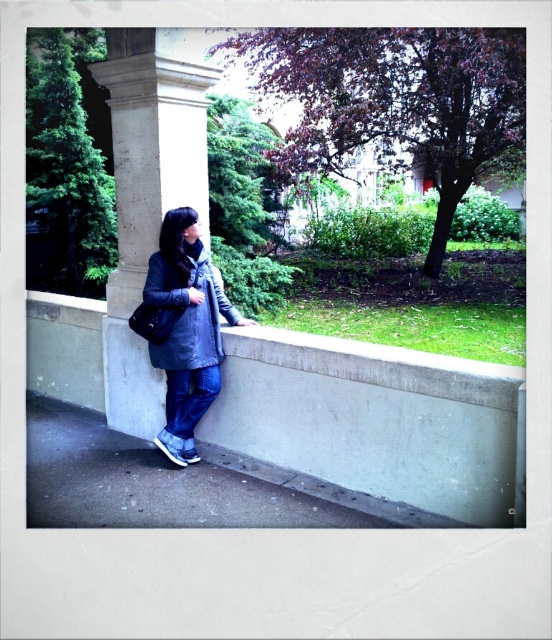
You are planning to hang a wide poster on the matte gray concrete wall at center and the smooth concrete pillar at center. Based on their widths, which surface would be more suitable for the poster?

The smooth concrete pillar at center has a greater width than the matte gray concrete wall at center, so it would be more suitable for hanging a wide poster.

You are a painter who needs to paint the smooth concrete pillar at center and the dark gray textured coat at center. Which object requires a taller ladder to reach its top?

The smooth concrete pillar at center requires a taller ladder because it is much taller than the dark gray textured coat at center.

You are standing at the point marked by the coordinates point (x=148, y=189). What object are you in front of?

The point (x=148, y=189) indicates a smooth concrete pillar at center, so you are in front of the smooth concrete pillar at center.